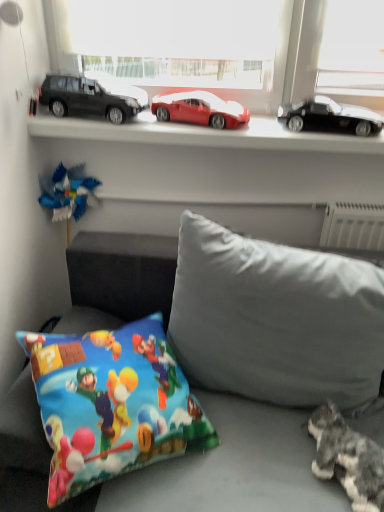
I want to click on free space to the back side of gray fluffy cat at lower right, so coord(314,408).